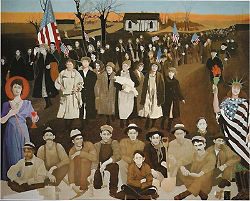
Image resolution: width=250 pixels, height=201 pixels. In order to click on poster in this screenshot , I will do `click(194, 91)`.